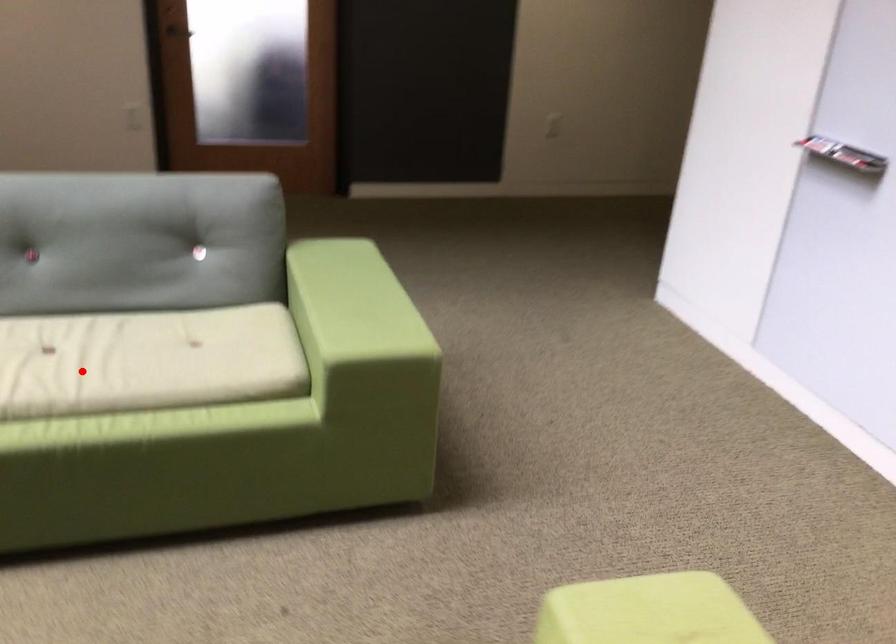
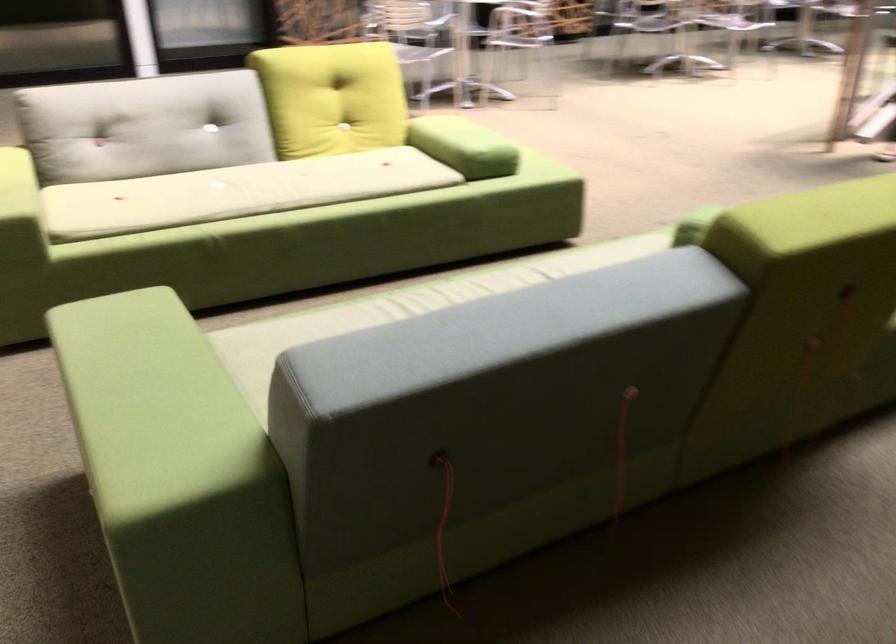
Question: I am providing you with two images of the same scene from different viewpoints. In image1, a red point is highlighted. Considering the same 3D point in image2, which of the following is correct?

Choices:
 (A) It is closer
 (B) It is farther

Answer: (B)